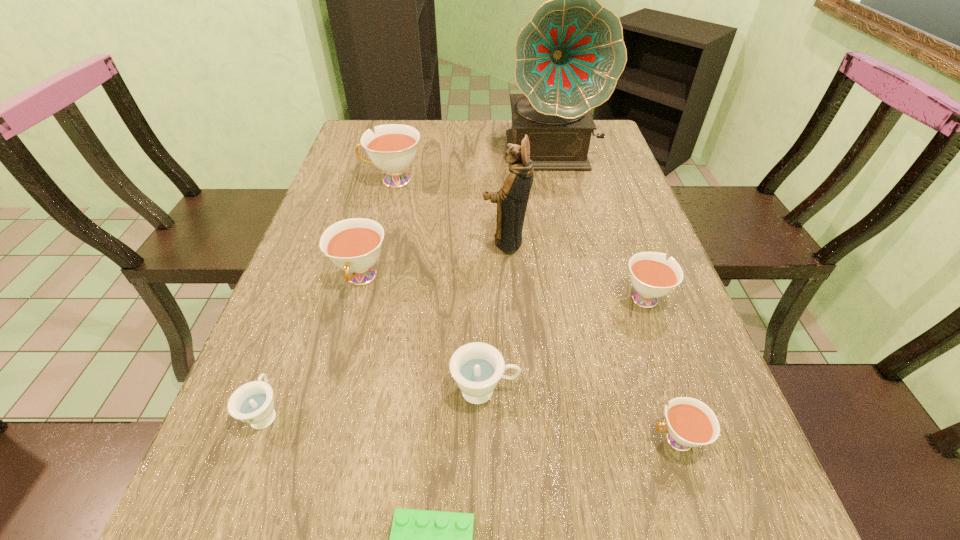
Find the location of a particular element. This screenshot has width=960, height=540. free space that satisfies the following two spatial constraints: 1. on the side of the biggest white teacup with the handle; 2. on the side of the second biggest white teacup with the handle is located at coordinates (369, 278).